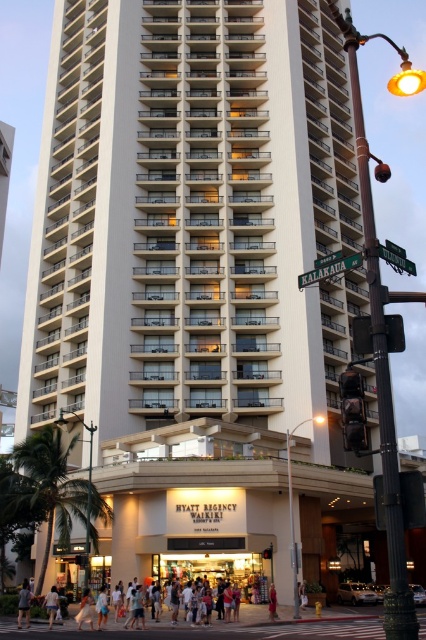
Question: Observing the image, what is the correct spatial positioning of light blue denim shorts at lower center in reference to red fabric dress at lower center?

Choices:
 (A) above
 (B) below

Answer: (B)

Question: Can you confirm if light blue denim shorts at lower left is smaller than red fabric dress at lower center?

Choices:
 (A) yes
 (B) no

Answer: (B)

Question: Which is nearer to the light blue denim shorts at lower left?

Choices:
 (A) red fabric dress at lower center
 (B) light blue denim shorts at lower center

Answer: (B)

Question: Is light blue denim shorts at lower left to the left of light blue denim shorts at lower center from the viewer's perspective?

Choices:
 (A) no
 (B) yes

Answer: (B)

Question: Which object is the closest to the red fabric dress at lower center?

Choices:
 (A) light blue denim shorts at lower left
 (B) light blue denim shorts at lower center

Answer: (B)

Question: Which point is closer to the camera?

Choices:
 (A) light blue denim shorts at lower left
 (B) red fabric dress at lower center
 (C) light blue denim shorts at lower center

Answer: (A)